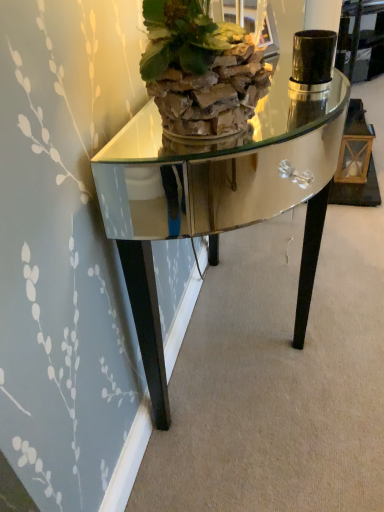
What do you see at coordinates (200, 70) in the screenshot? I see `green leafy plant at upper center` at bounding box center [200, 70].

This screenshot has height=512, width=384. I want to click on green leafy plant at upper center, so click(x=200, y=70).

What is the approximate width of shiny mirrored table at center?

The width of shiny mirrored table at center is 20.69 inches.

This screenshot has width=384, height=512. What do you see at coordinates (219, 197) in the screenshot?
I see `shiny mirrored table at center` at bounding box center [219, 197].

At what (x,y) coordinates should I click in order to perform the action: click on shiny mirrored table at center. Please return your answer as a coordinate pair (x, y). Looking at the image, I should click on (219, 197).

What is the approximate height of shiny mirrored table at center?

The height of shiny mirrored table at center is 74.47 centimeters.

Image resolution: width=384 pixels, height=512 pixels. I want to click on green leafy plant at upper center, so click(200, 70).

Which object is positioned more to the right, shiny mirrored table at center or green leafy plant at upper center?

shiny mirrored table at center.

Considering the positions of objects shiny mirrored table at center and green leafy plant at upper center in the image provided, who is in front, shiny mirrored table at center or green leafy plant at upper center?

green leafy plant at upper center is more forward.

Does point (312, 126) lie in front of point (159, 110)?

No, (312, 126) is further to viewer.

From the image's perspective, which is below, shiny mirrored table at center or green leafy plant at upper center?

From the image's view, shiny mirrored table at center is below.

From a real-world perspective, which object rests below the other?

From a 3D spatial view, shiny mirrored table at center is below.

From the picture: In terms of width, does shiny mirrored table at center look wider or thinner when compared to green leafy plant at upper center?

shiny mirrored table at center is wider than green leafy plant at upper center.

Considering the sizes of objects shiny mirrored table at center and green leafy plant at upper center in the image provided, who is shorter, shiny mirrored table at center or green leafy plant at upper center?

green leafy plant at upper center.

Which of these two, shiny mirrored table at center or green leafy plant at upper center, is smaller?

Smaller between the two is green leafy plant at upper center.

Does shiny mirrored table at center contain green leafy plant at upper center?

No, green leafy plant at upper center is not surrounded by shiny mirrored table at center.

Is shiny mirrored table at center directly adjacent to green leafy plant at upper center?

No, shiny mirrored table at center is not touching green leafy plant at upper center.

From the picture: Is shiny mirrored table at center facing towards green leafy plant at upper center?

No, shiny mirrored table at center is not aimed at green leafy plant at upper center.

The width and height of the screenshot is (384, 512). I want to click on houseplant that appears above the shiny mirrored table at center (from the image's perspective), so click(x=200, y=70).

Is green leafy plant at upper center to the left of shiny mirrored table at center from the viewer's perspective?

Yes, green leafy plant at upper center is to the left of shiny mirrored table at center.

Is green leafy plant at upper center in front of or behind shiny mirrored table at center in the image?

Clearly, green leafy plant at upper center is in front of shiny mirrored table at center.

Considering the points (167, 126) and (290, 124), which point is in front, point (167, 126) or point (290, 124)?

Positioned in front is point (167, 126).

From the image's perspective, is green leafy plant at upper center positioned above or below shiny mirrored table at center?

Based on their image positions, green leafy plant at upper center is located above shiny mirrored table at center.

From a real-world perspective, is green leafy plant at upper center located higher than shiny mirrored table at center?

Yes, from a real-world perspective, green leafy plant at upper center is above shiny mirrored table at center.

In terms of width, does green leafy plant at upper center look wider or thinner when compared to shiny mirrored table at center?

Clearly, green leafy plant at upper center has less width compared to shiny mirrored table at center.

Does green leafy plant at upper center have a greater height compared to shiny mirrored table at center?

Incorrect, the height of green leafy plant at upper center is not larger of that of shiny mirrored table at center.

Is green leafy plant at upper center bigger than shiny mirrored table at center?

No, green leafy plant at upper center is not bigger than shiny mirrored table at center.

Is shiny mirrored table at center surrounded by green leafy plant at upper center?

No, green leafy plant at upper center does not contain shiny mirrored table at center.

Is green leafy plant at upper center far away from shiny mirrored table at center?

green leafy plant at upper center is far away from shiny mirrored table at center.

In the scene shown: Is green leafy plant at upper center facing towards shiny mirrored table at center?

No, green leafy plant at upper center is not aimed at shiny mirrored table at center.

How different are the orientations of green leafy plant at upper center and shiny mirrored table at center in degrees?

The facing directions of green leafy plant at upper center and shiny mirrored table at center are 2.55 degrees apart.

Where is `houseplant in front of the shiny mirrored table at center`? The image size is (384, 512). houseplant in front of the shiny mirrored table at center is located at coordinates (200, 70).

Where is `table behind the green leafy plant at upper center`? table behind the green leafy plant at upper center is located at coordinates (219, 197).

Locate an element on the screen. Image resolution: width=384 pixels, height=512 pixels. table below the green leafy plant at upper center (from the image's perspective) is located at coordinates (219, 197).